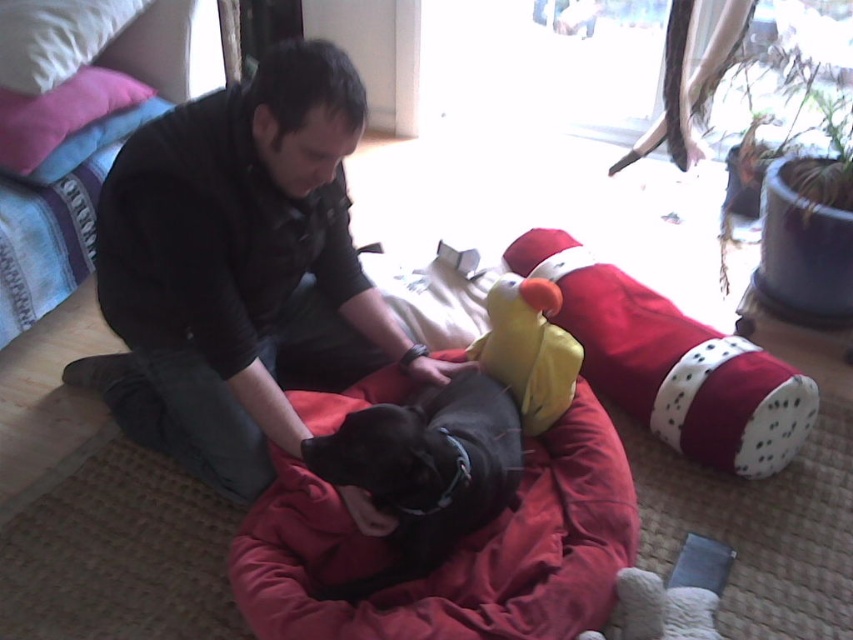
Is point (292, 516) closer to viewer compared to point (517, 390)?

Yes, point (292, 516) is in front of point (517, 390).

Between point (369, 602) and point (550, 416), which one is positioned behind?

Point (550, 416)

Where is `velvet-like red dog bed at center`? velvet-like red dog bed at center is located at coordinates (453, 552).

Which is above, black matte shirt at center or white soft pillow at upper left?

Positioned higher is white soft pillow at upper left.

Looking at this image, is black matte shirt at center positioned before white soft pillow at upper left?

Yes, it is in front of white soft pillow at upper left.

Does point (228, 244) lie in front of point (9, 20)?

Yes, it is in front of point (9, 20).

The image size is (853, 640). In order to click on black matte shirt at center in this screenshot , I will do `click(238, 269)`.

Between black smooth dog at center and velvet pink pillow at upper left, which one is positioned higher?

Positioned higher is velvet pink pillow at upper left.

You are a GUI agent. You are given a task and a screenshot of the screen. Output one action in this format:
    pyautogui.click(x=<x>, y=<y>)
    Task: Click on the black smooth dog at center
    
    Given the screenshot: What is the action you would take?
    pyautogui.click(x=426, y=468)

The width and height of the screenshot is (853, 640). Identify the location of black smooth dog at center. (426, 468).